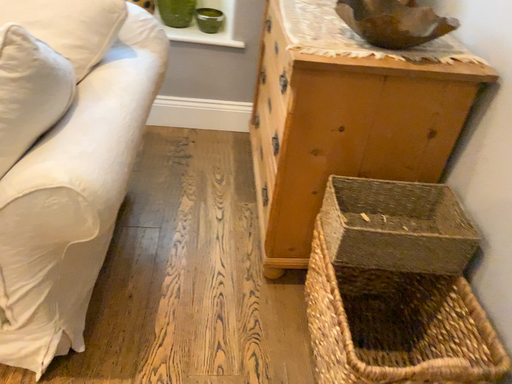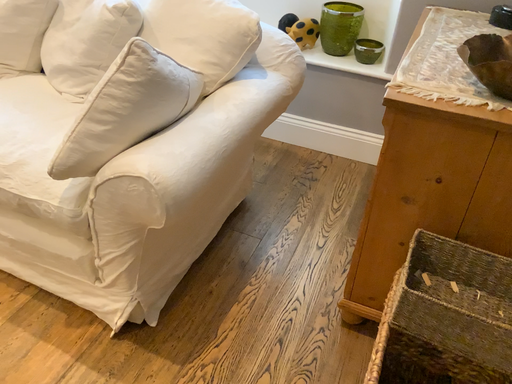
Question: Which way did the camera rotate in the video?

Choices:
 (A) rotated left
 (B) rotated right

Answer: (A)